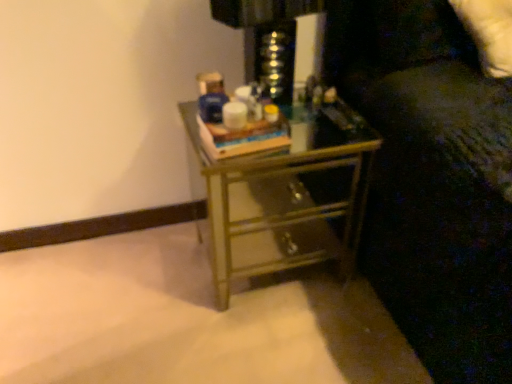
What do you see at coordinates (280, 193) in the screenshot? I see `metallic gold nightstand at center` at bounding box center [280, 193].

Where is `metallic gold nightstand at center`? This screenshot has width=512, height=384. metallic gold nightstand at center is located at coordinates (280, 193).

Find the location of `metallic gold nightstand at center`. metallic gold nightstand at center is located at coordinates (280, 193).